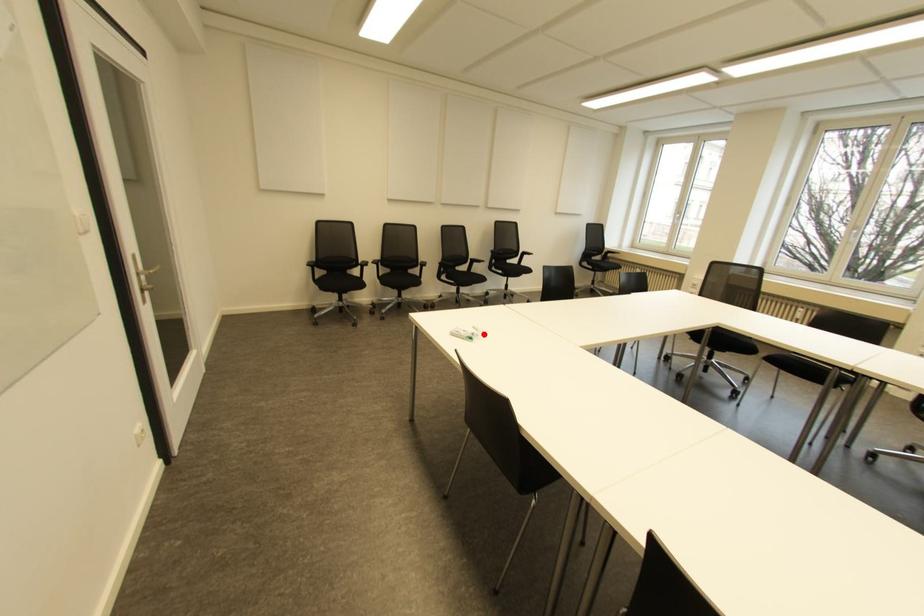
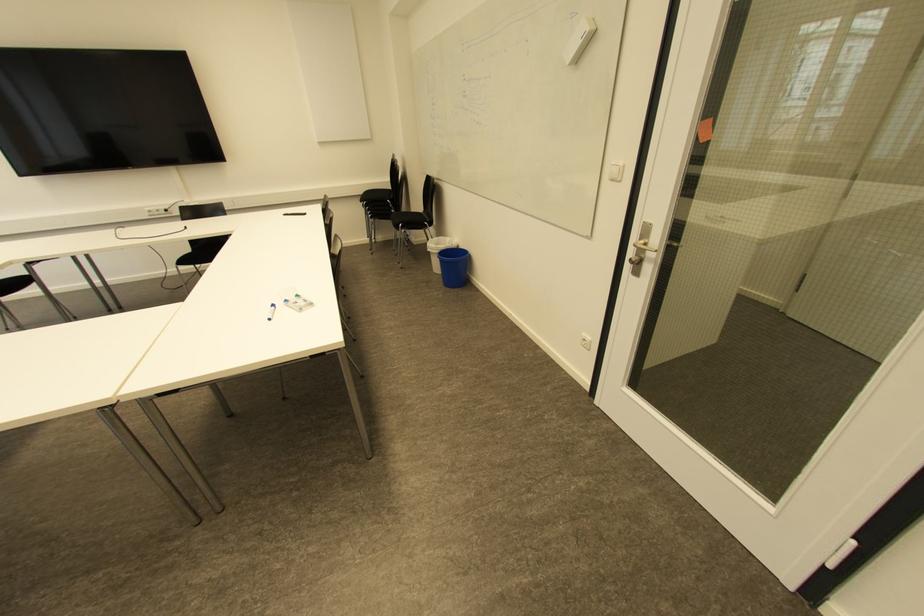
Where in the second image is the point corresponding to the highlighted location from the first image?

(273, 306)